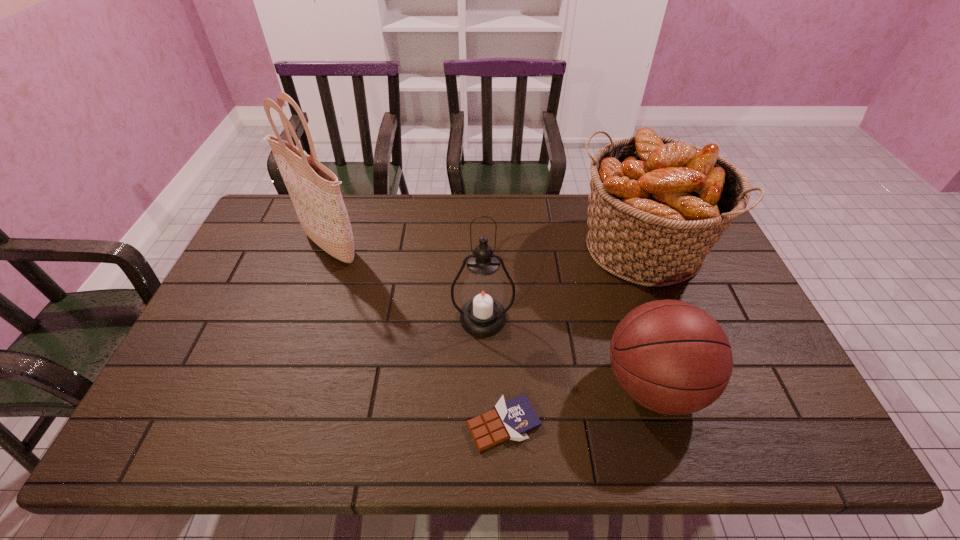
Where is `shopping bag`? shopping bag is located at coordinates (314, 190).

Where is `the tallest object`? the tallest object is located at coordinates (314, 190).

I want to click on oil lamp, so click(x=483, y=315).

Identify the location of basket. The width and height of the screenshot is (960, 540). (657, 205).

Identify the location of basketball. The image size is (960, 540). (671, 357).

Image resolution: width=960 pixels, height=540 pixels. I want to click on chocolate bar, so click(512, 419).

Locate an element on the screen. The width and height of the screenshot is (960, 540). vacant space located 0.110m on the back of the leftmost object is located at coordinates (345, 201).

Where is `vacant space situated 0.290m on the back of the third nearest object`? The width and height of the screenshot is (960, 540). vacant space situated 0.290m on the back of the third nearest object is located at coordinates pyautogui.click(x=482, y=235).

Locate an element on the screen. The width and height of the screenshot is (960, 540). vacant space located on the left of the basket is located at coordinates 534,248.

Locate an element on the screen. This screenshot has height=540, width=960. free region located on the right of the fourth tallest object is located at coordinates 729,386.